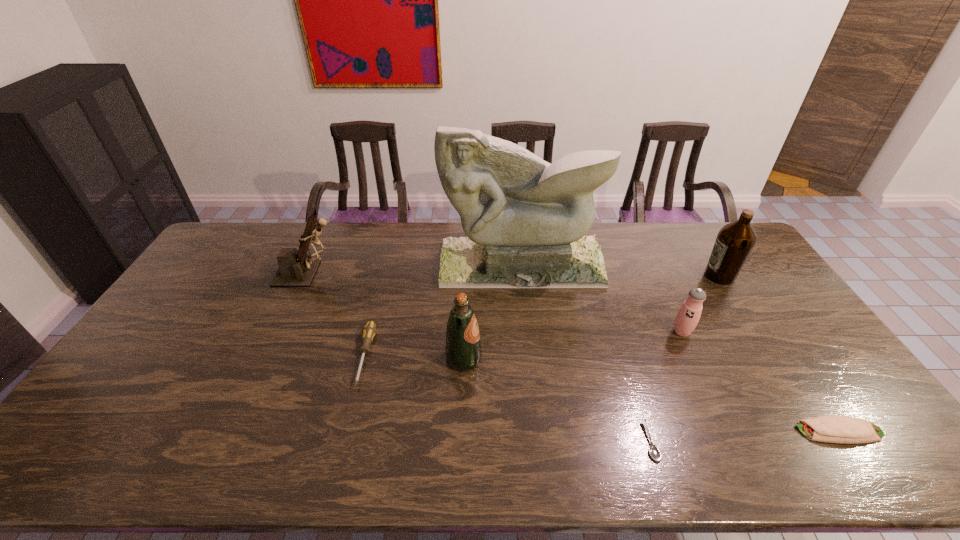
You are a GUI agent. You are given a task and a screenshot of the screen. Output one action in this format:
    pyautogui.click(x=<x>, y=<y>)
    Task: Click on the blank space located at the bitten end of the seventh tallest object
    The width and height of the screenshot is (960, 540).
    Given the screenshot: What is the action you would take?
    pyautogui.click(x=740, y=431)

Locate an element on the screen. This screenshot has width=960, height=540. vacant region located on the back of the soupspoon is located at coordinates (626, 361).

I want to click on object that is at the far edge, so click(x=525, y=219).

You are a GUI agent. You are given a task and a screenshot of the screen. Output one action in this format:
    pyautogui.click(x=<x>, y=<y>)
    Task: Click on the burrito located in the near edge section of the desktop
    
    Given the screenshot: What is the action you would take?
    pyautogui.click(x=843, y=429)

Locate an element on the screen. soupspoon that is at the near edge is located at coordinates (654, 451).

Find the location of a particular element. This screenshot has width=960, height=540. olive oil located at the right edge is located at coordinates (735, 240).

The height and width of the screenshot is (540, 960). I want to click on burrito that is at the right edge, so click(843, 429).

Find the location of a particular element. Image resolution: width=960 pixels, height=540 pixels. object present at the near right corner is located at coordinates (843, 429).

The image size is (960, 540). What are the coordinates of `vacant space at the far edge` in the screenshot? It's located at (668, 241).

The width and height of the screenshot is (960, 540). I want to click on vacant position at the left edge of the desktop, so click(191, 340).